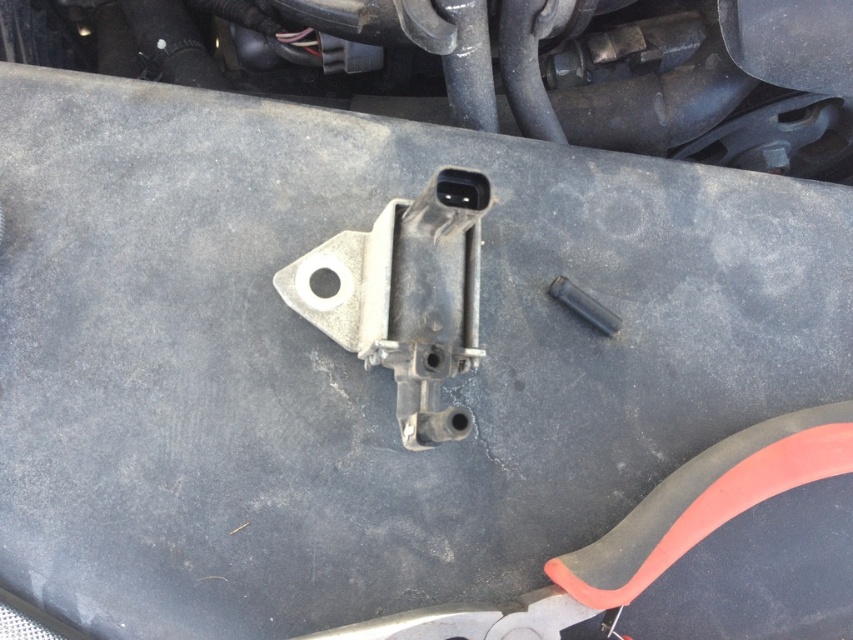
Question: Which point is farther from the camera taking this photo?

Choices:
 (A) (479, 250)
 (B) (569, 280)

Answer: (B)

Question: Is metallic gray bracket at center behind black metal bolt at center?

Choices:
 (A) yes
 (B) no

Answer: (B)

Question: Is metallic gray bracket at center positioned at the back of black metal bolt at center?

Choices:
 (A) yes
 (B) no

Answer: (B)

Question: Which object is closer to the camera taking this photo?

Choices:
 (A) metallic gray bracket at center
 (B) black metal bolt at center

Answer: (A)

Question: In this image, where is metallic gray bracket at center located relative to black metal bolt at center?

Choices:
 (A) below
 (B) above

Answer: (A)

Question: Which point is farther to the camera?

Choices:
 (A) (581, 296)
 (B) (337, 342)

Answer: (A)